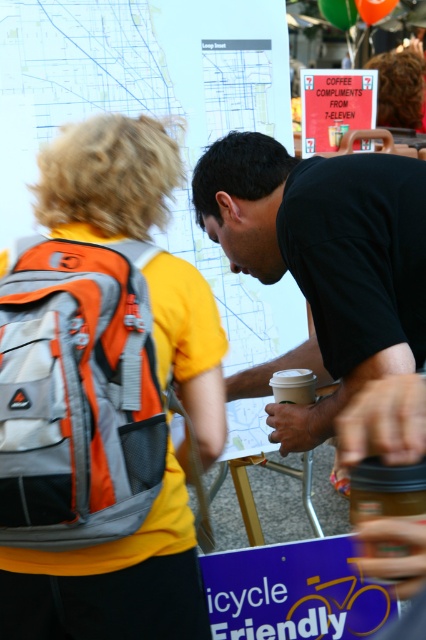
You are standing in front of the map display at the community cycling event. Where exactly is the white paper map at upper left located in terms of coordinates?

The white paper map at upper left is located at point (157, 116).

You are at the community event and need to locate the orange fabric backpack at left. According to the map displayed on the stand, where is this backpack positioned in relation to the other objects in the scene?

The orange fabric backpack at left is located at point (77,394) on the map.